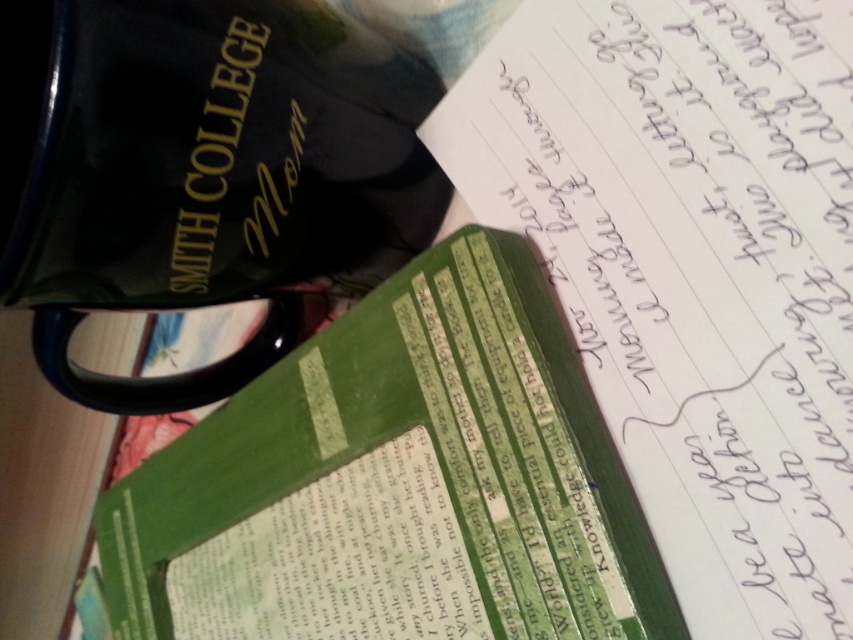
Is green textured notebook at center thinner than green paper notebook at center?

Yes.

Between green textured notebook at center and green paper notebook at center, which one appears on the left side from the viewer's perspective?

green paper notebook at center

Is point (764, 589) positioned after point (285, 468)?

No.

At what (x,y) coordinates should I click in order to perform the action: click on green textured notebook at center. Please return your answer as a coordinate pair (x, y). The width and height of the screenshot is (853, 640). Looking at the image, I should click on (693, 269).